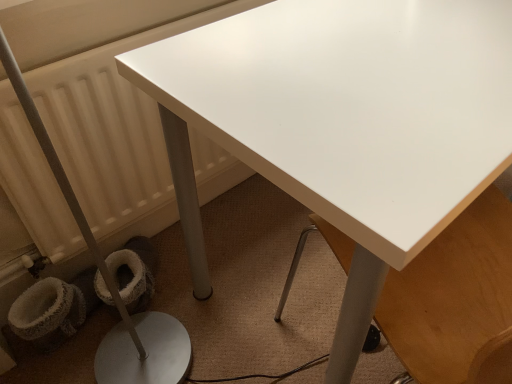
Identify the location of free space above white plastic radiator at upper left (from a real-world perspective). The image size is (512, 384). (156, 25).